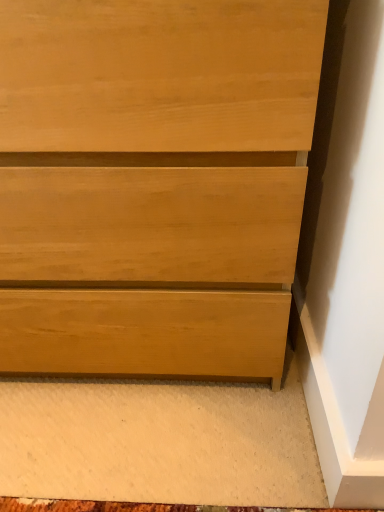
What is the approximate width of matte wood chest of drawers at lower right?

matte wood chest of drawers at lower right is 20.36 inches in width.

I want to click on matte wood chest of drawers at lower right, so click(x=153, y=183).

Describe the element at coordinates (153, 183) in the screenshot. I see `matte wood chest of drawers at lower right` at that location.

Image resolution: width=384 pixels, height=512 pixels. I want to click on matte wood chest of drawers at lower right, so (x=153, y=183).